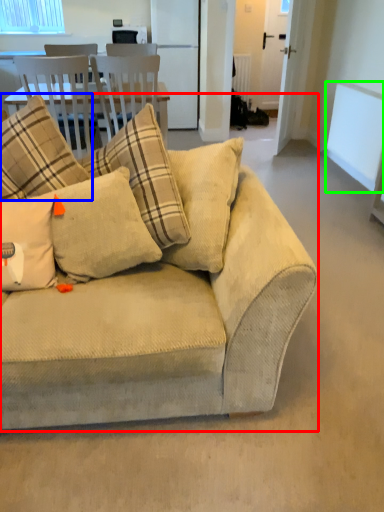
Question: Which is nearer to the studio couch (highlighted by a red box)? pillow (highlighted by a blue box) or window screen (highlighted by a green box).

Choices:
 (A) pillow
 (B) window screen

Answer: (A)